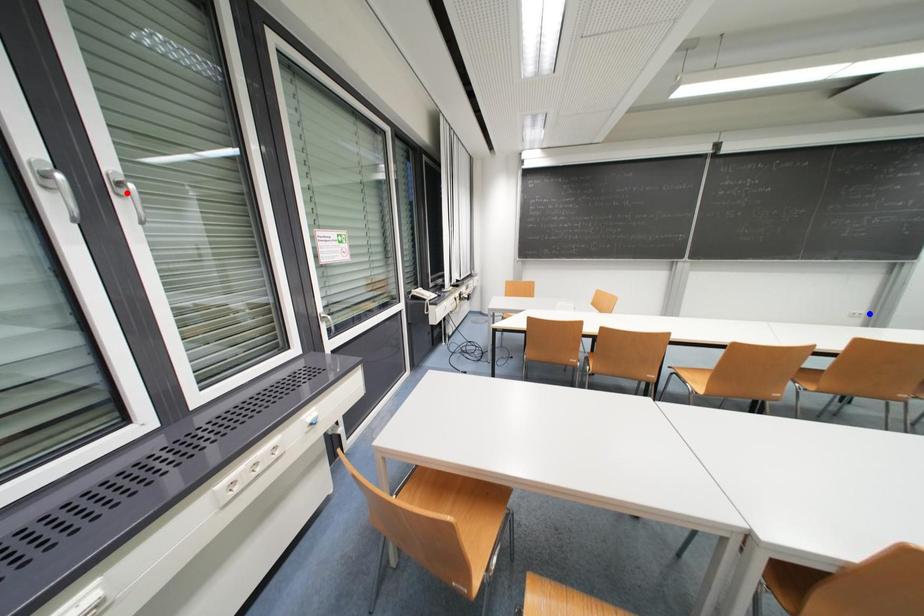
Question: In the image, two points are highlighted. Which point is nearer to the camera? Reply with the corresponding letter.

Choices:
 (A) blue point
 (B) red point

Answer: (B)